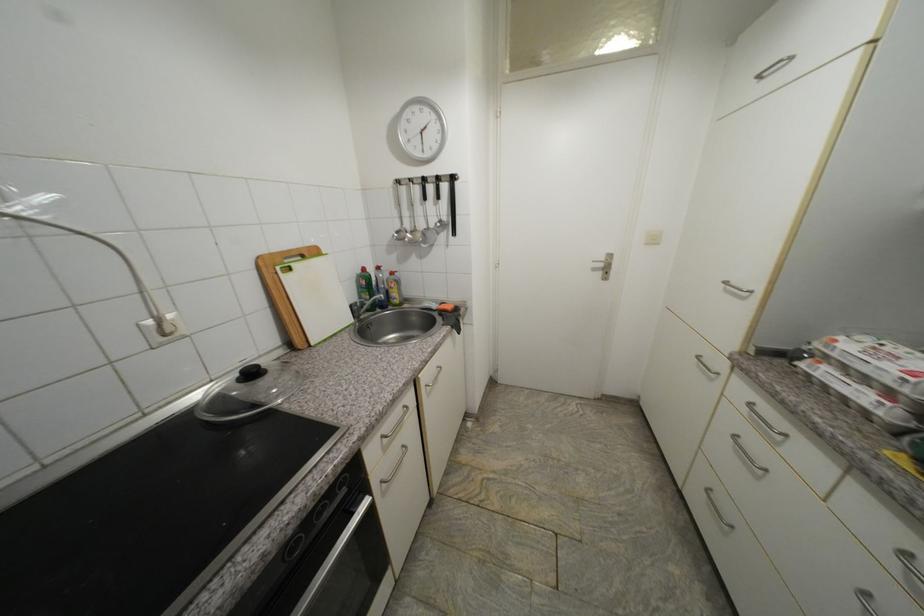
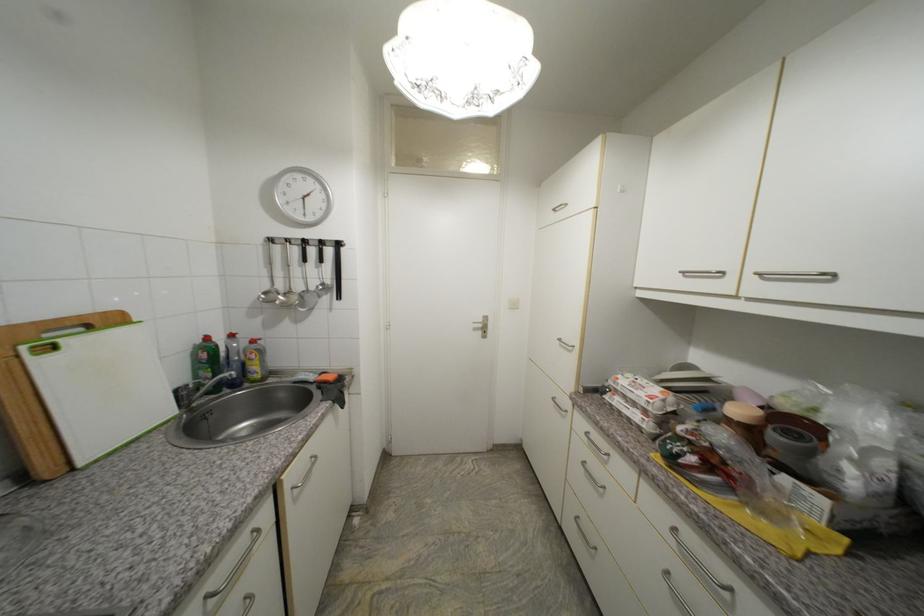
The point at (373, 299) is marked in the first image. Where is the corresponding point in the second image?

(215, 377)